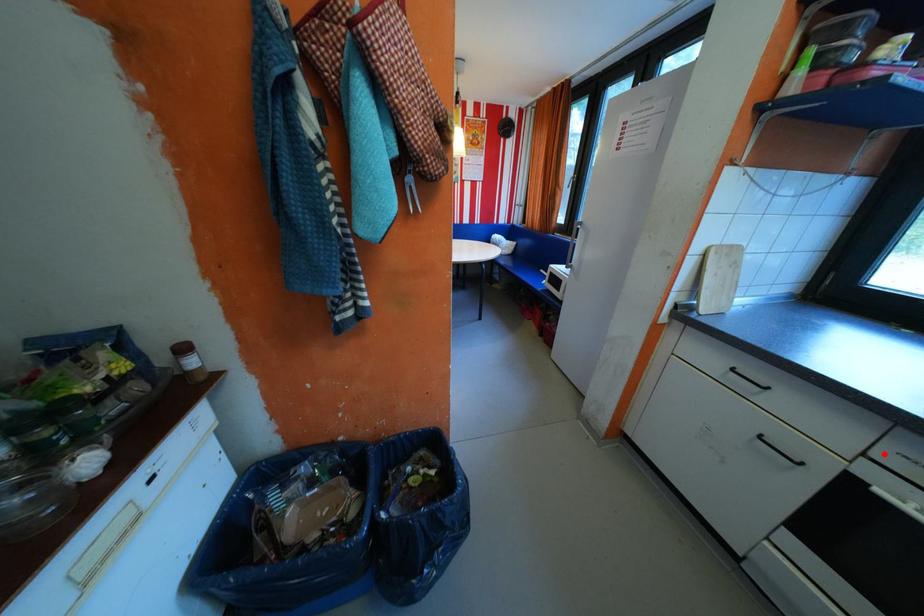
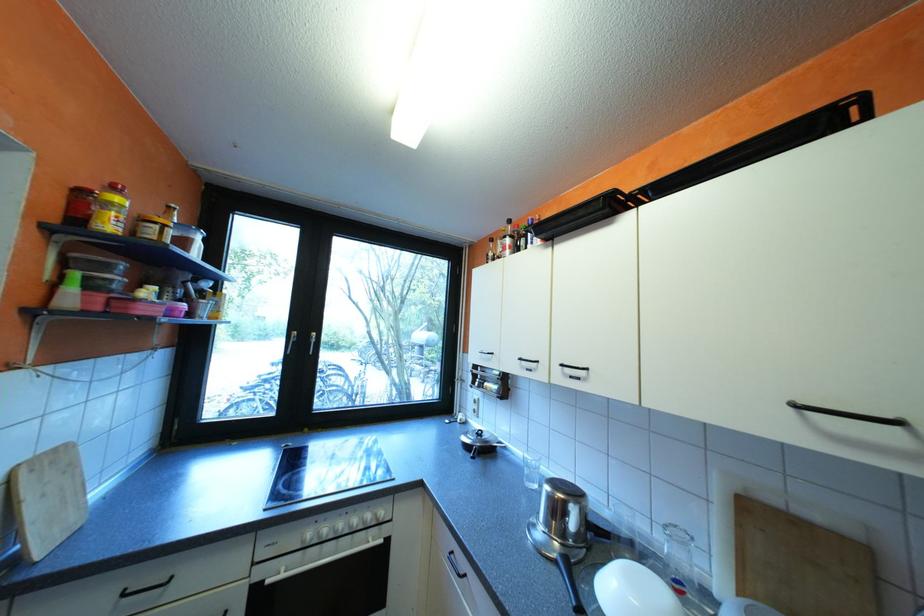
Question: I am providing you with two images of the same scene from different viewpoints. A red point is shown in image1. For the corresponding object point in image2, is it positioned nearer or farther from the camera?

Choices:
 (A) Nearer
 (B) Farther

Answer: (A)